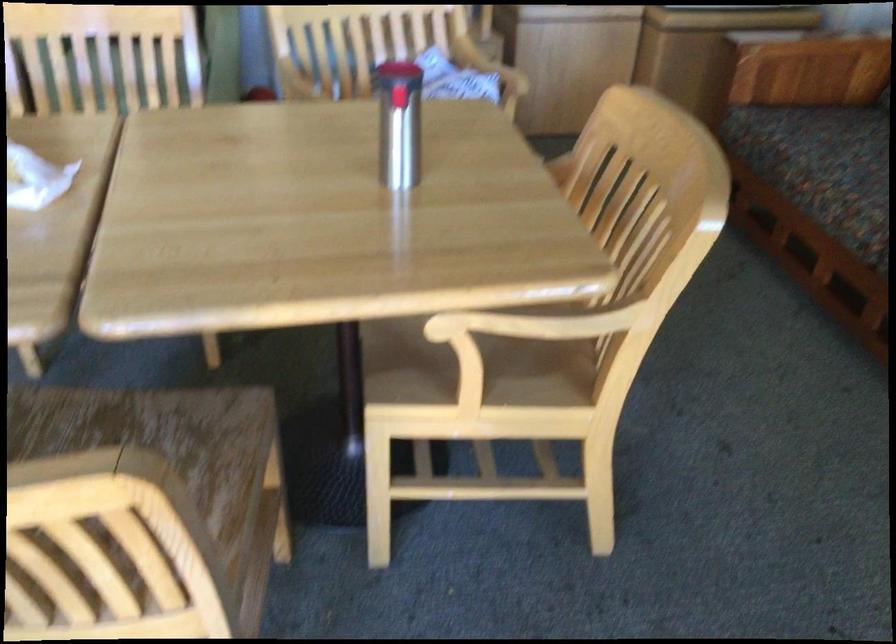
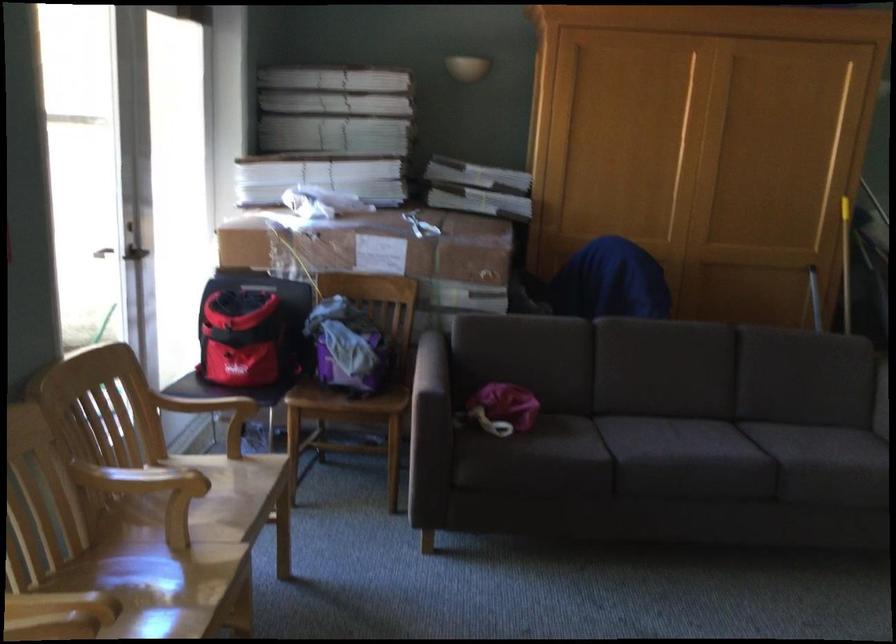
First-person continuous shooting, in which direction is the camera rotating?

The camera rotated toward left-down.